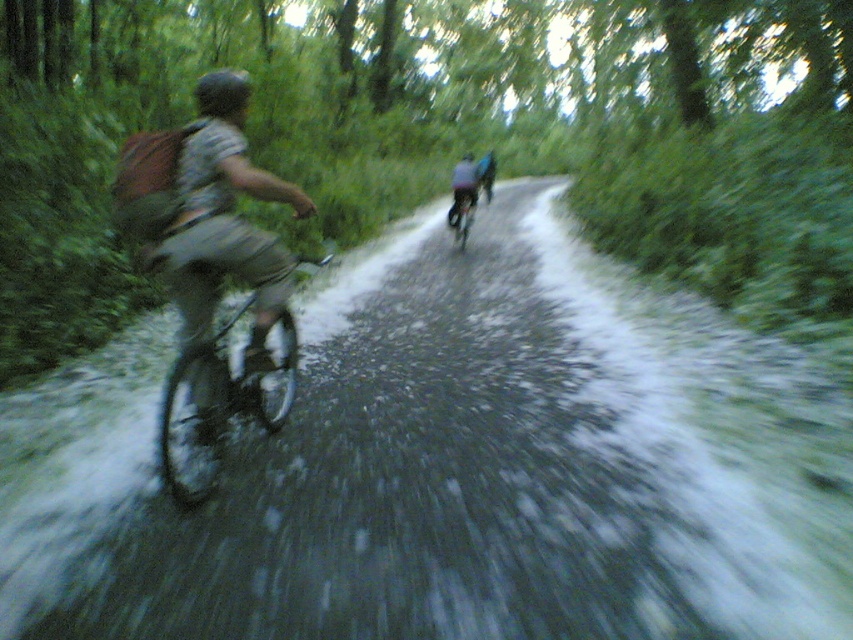
You are a cyclist on the path and see the matte black helmet at upper center and the metallic silver bicycle at center. Which object is closer to you?

The matte black helmet at upper center is closer to you because it is positioned in front of the metallic silver bicycle at center, indicating it is nearer in the scene.

You are a cyclist on a gravel path and see the matte black helmet at upper center and the metallic silver bicycle at center. Which object is positioned to the left?

The matte black helmet at upper center is to the left of the metallic silver bicycle at center.

You are a photographer trying to capture both metallic silver bicycles in a single shot. Given that your camera can only focus on objects wider than 1.2 meters, will both metallic silver bicycle at left and metallic silver bicycle at center fit within the camera focus range?

The metallic silver bicycle at left is wider than the metallic silver bicycle at center. Since the camera requires objects wider than 1.2 meters, we need to check both widths. However, without knowing the exact width of the narrower bicycle, we can only confirm the left one meets the requirement. Thus, the center bicycle might not qualify, so both may not fully fit.